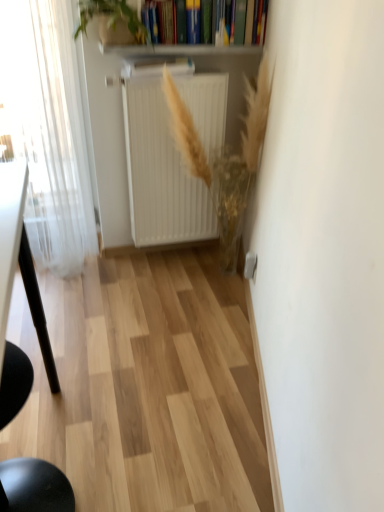
Question: In terms of size, does golden textured plant at center, positioned as the second plant in left-to-right order, appear bigger or smaller than green leafy plant at upper center, the 2th plant in the right-to-left sequence?

Choices:
 (A) small
 (B) big

Answer: (B)

Question: Is golden textured plant at center, arranged as the 1th plant when ordered from the bottom, in front of or behind green leafy plant at upper center, the 2th plant in the right-to-left sequence, in the image?

Choices:
 (A) front
 (B) behind

Answer: (B)

Question: Considering the real-world distances, which object is farthest from the green leafy plant at upper center, which is the 1th plant in top-to-bottom order?

Choices:
 (A) golden textured plant at center, arranged as the 1th plant when ordered from the bottom
 (B) black matte chair at lower left
 (C) white matte radiator at center
 (D) white sheer curtain at left
 (E) hardcover book at upper center

Answer: (B)

Question: Estimate the real-world distances between objects in this image. Which object is closer to the black matte chair at lower left?

Choices:
 (A) green leafy plant at upper center, the first plant positioned from the left
 (B) golden textured plant at center, arranged as the 1th plant when ordered from the bottom
 (C) white sheer curtain at left
 (D) hardcover book at upper center
 (E) white matte radiator at center

Answer: (C)